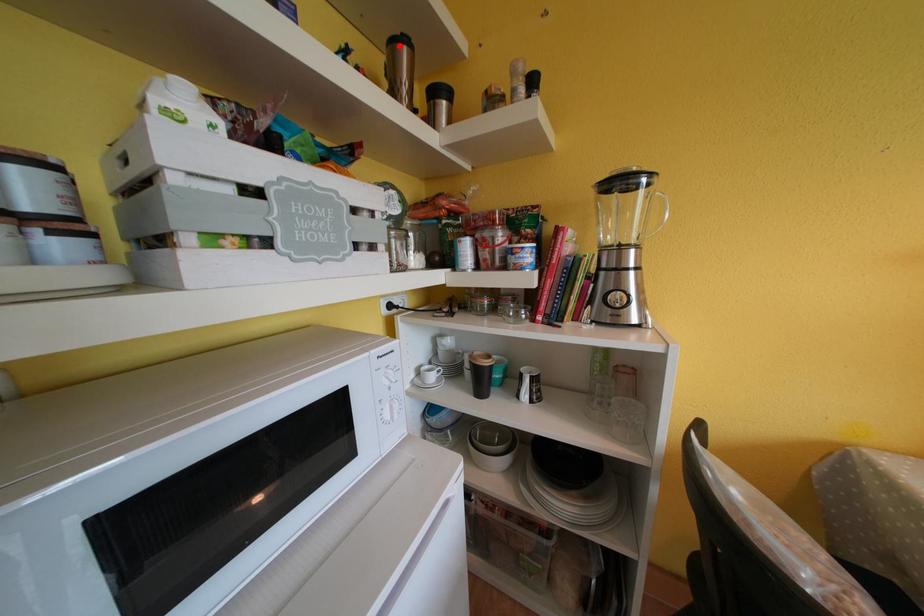
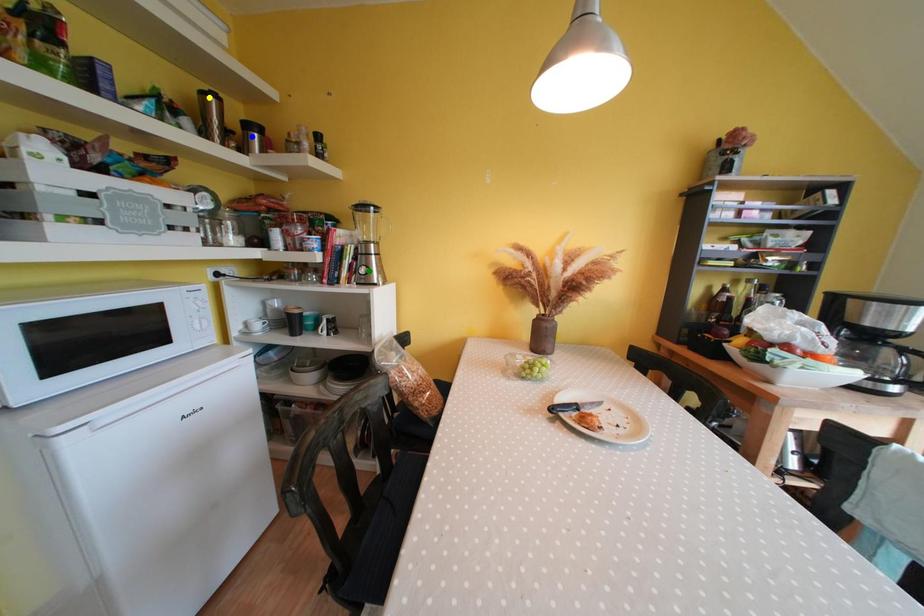
Question: I am providing you with two images of the same scene from different viewpoints. A red point is marked on the first image. You are given multiple points on the second image. Which mark in image 2 goes with the point in image 1?

Choices:
 (A) green point
 (B) yellow point
 (C) blue point

Answer: (B)